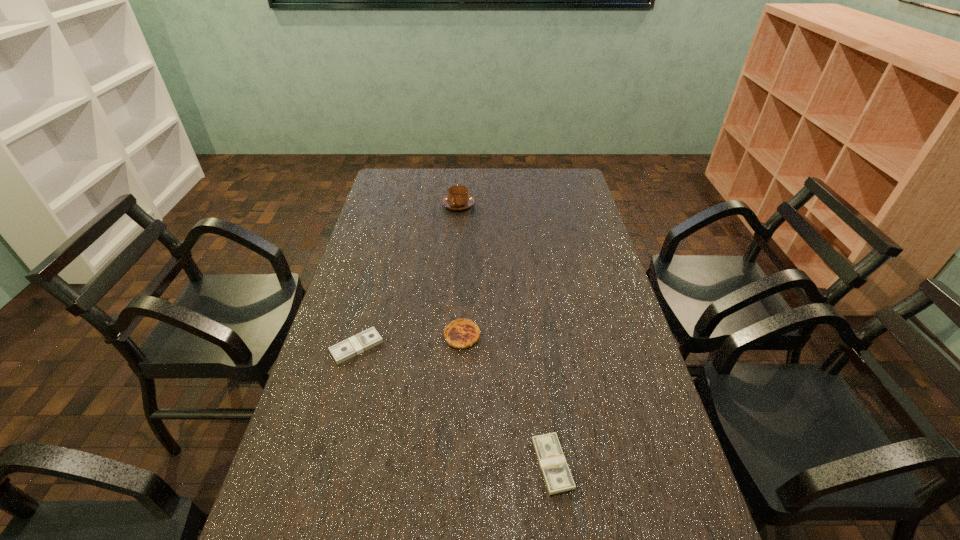
You are a GUI agent. You are given a task and a screenshot of the screen. Output one action in this format:
    pyautogui.click(x=<x>, y=<y>)
    Task: Click on the tallest object
    
    Given the screenshot: What is the action you would take?
    pyautogui.click(x=458, y=199)

Identify the location of the farthest object. (458, 199).

At what (x,y) coordinates should I click in order to perform the action: click on the second tallest object. Please return your answer as a coordinate pair (x, y). Looking at the image, I should click on pyautogui.click(x=462, y=333).

The image size is (960, 540). In order to click on the leftmost object in this screenshot , I will do `click(369, 338)`.

At what (x,y) coordinates should I click in order to perform the action: click on the farther dollar. Please return your answer as a coordinate pair (x, y). The height and width of the screenshot is (540, 960). Looking at the image, I should click on (369, 338).

Locate an element on the screen. the right dollar is located at coordinates (556, 473).

This screenshot has height=540, width=960. In order to click on the nearer dollar in this screenshot , I will do `click(556, 473)`.

I want to click on free space located 0.210m on the side of the cappuccino with the handle, so click(x=456, y=244).

This screenshot has height=540, width=960. I want to click on free space located on the right of the quiche, so click(x=514, y=336).

You are a GUI agent. You are given a task and a screenshot of the screen. Output one action in this format:
    pyautogui.click(x=<x>, y=<y>)
    Task: Click on the vacant space situated on the right of the leftmost object
    Image resolution: width=960 pixels, height=540 pixels.
    Given the screenshot: What is the action you would take?
    pyautogui.click(x=441, y=347)